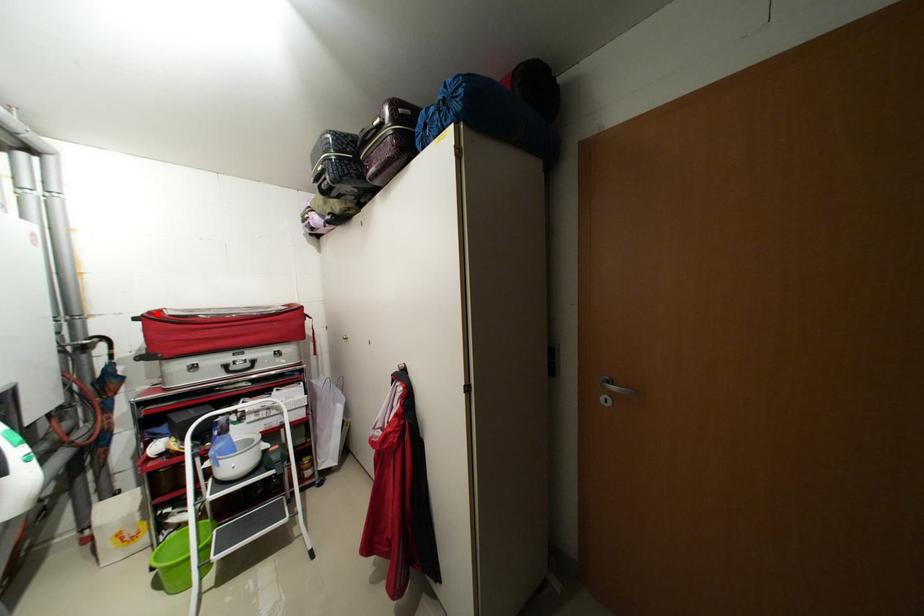
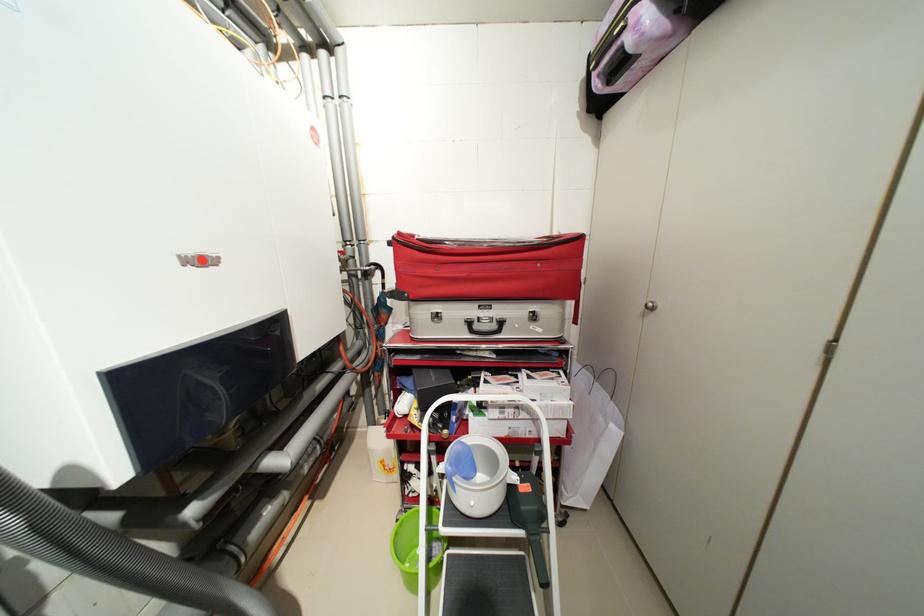
Find the pixel in the second image that matches the highlighted location in the first image.

(407, 235)